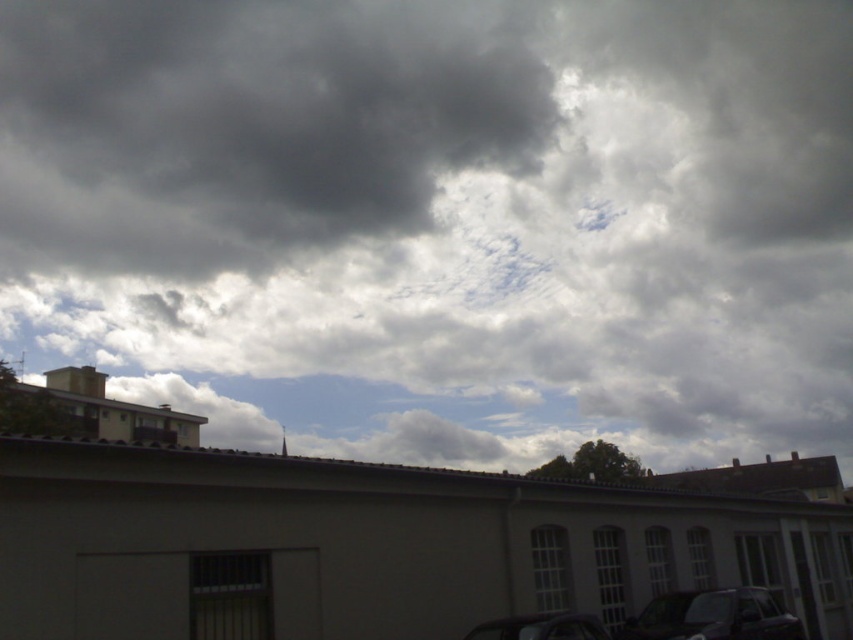
Question: Which point appears closest to the camera in this image?

Choices:
 (A) 654,620
 (B) 132,216
 (C) 225,212

Answer: (A)

Question: Is shiny black car at bottom right to the left of shiny black car at lower center from the viewer's perspective?

Choices:
 (A) no
 (B) yes

Answer: (A)

Question: Among these points, which one is nearest to the camera?

Choices:
 (A) (531, 630)
 (B) (241, 273)

Answer: (A)

Question: Is shiny black car at bottom right closer to camera compared to shiny black car at lower center?

Choices:
 (A) no
 (B) yes

Answer: (A)

Question: Which point is closer to the camera?

Choices:
 (A) (781, 627)
 (B) (509, 634)
 (C) (314, 84)

Answer: (B)

Question: Observing the image, what is the correct spatial positioning of dark gray cloud at upper left in reference to shiny black car at bottom right?

Choices:
 (A) below
 (B) above

Answer: (B)